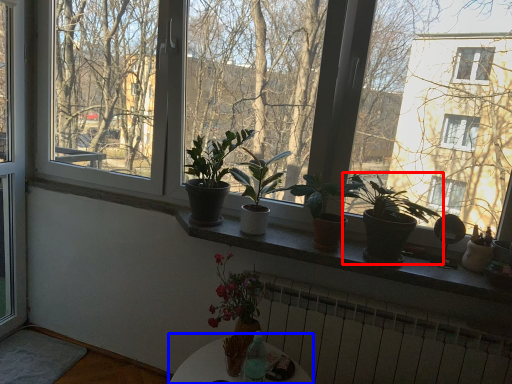
Question: Which point is closer to the camera, houseplant (highlighted by a red box) or round table (highlighted by a blue box)?

Choices:
 (A) houseplant
 (B) round table

Answer: (B)